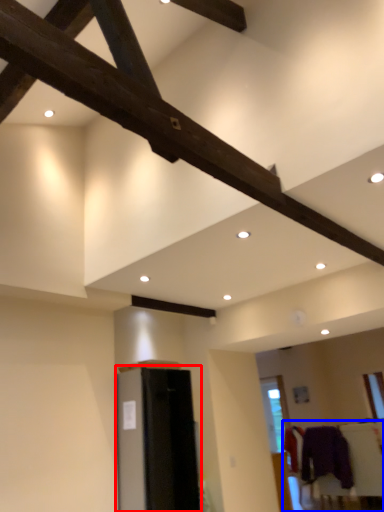
Question: Which of the following is the closest to the observer, furniture (highlighted by a red box) or furniture (highlighted by a blue box)?

Choices:
 (A) furniture
 (B) furniture

Answer: (A)